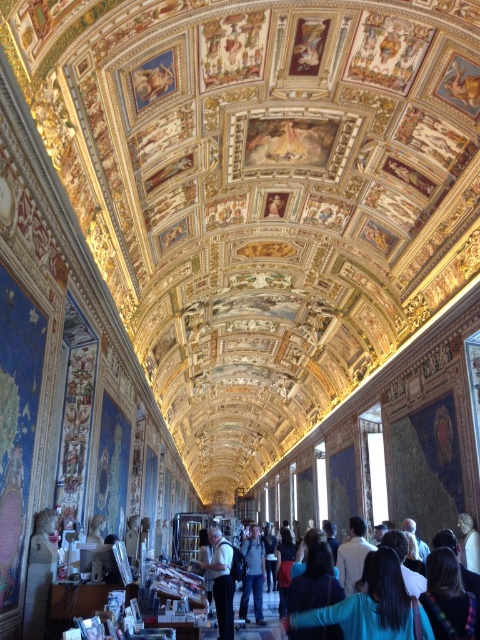
Question: Which point is farther from the camera taking this photo?

Choices:
 (A) (316, 636)
 (B) (250, 579)
 (C) (280, 609)
 (D) (453, 637)

Answer: (B)

Question: Can you confirm if dark brown hair at lower right is bigger than denim jacket at center?

Choices:
 (A) no
 (B) yes

Answer: (A)

Question: Which of the following is the closest to the observer?

Choices:
 (A) dark blue fabric at center
 (B) blue denim jeans at center
 (C) dark blue shirt at center
 (D) blue fabric at center

Answer: (D)

Question: Is dark blue shirt at center bigger than blue denim jeans at center?

Choices:
 (A) no
 (B) yes

Answer: (A)

Question: Does blue fabric at center appear under dark blue shirt at center?

Choices:
 (A) yes
 (B) no

Answer: (B)

Question: Among these objects, which one is farthest from the camera?

Choices:
 (A) dark blue shirt at center
 (B) dark brown hair at lower right

Answer: (A)